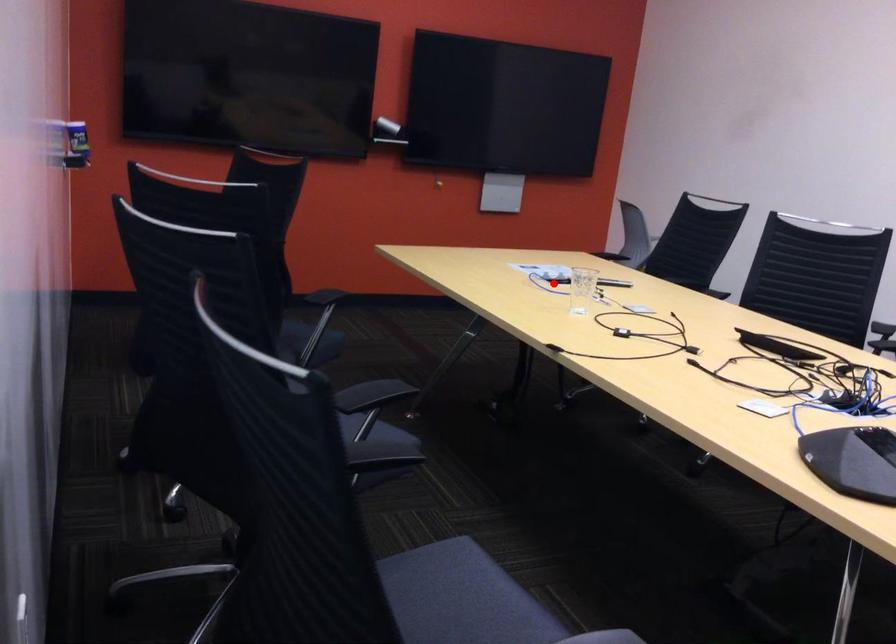
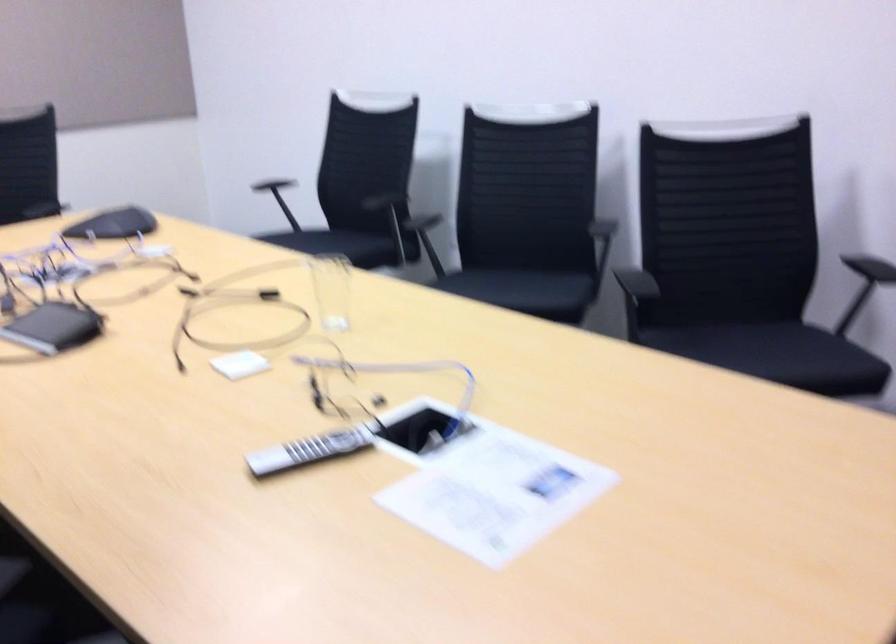
Question: I am providing you with two images of the same scene from different viewpoints. Image1 has a red point marked. In image2, the corresponding 3D location appears at what relative position? Reply with the corresponding letter.

Choices:
 (A) Closer
 (B) Farther

Answer: (A)